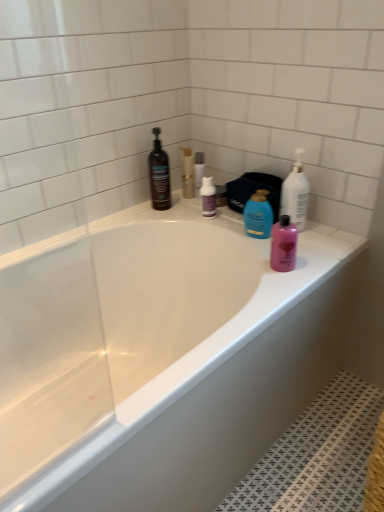
In order to click on free space to the right of matte black bottle at upper left, which is the 1th cleaning product from left to right in this screenshot , I will do `click(188, 216)`.